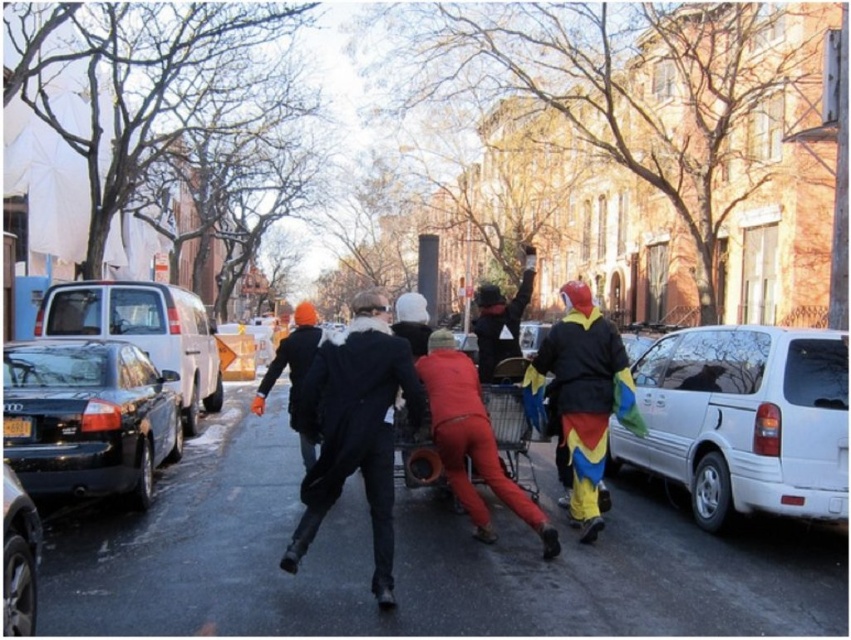
You are a delivery person trying to park your truck in the space between the white matte van at right and the black wool coat at center. Can your truck fit there?

The white matte van at right is smaller than the black wool coat at center, so the space between them may not be large enough for your truck. Check the dimensions carefully before attempting to park.

You are a delivery person trying to deliver a package to the address located near the multicolored fabric pants at right and the metallic silver shopping cart at center. Based on the scene, which object is closer to the delivery location?

The multicolored fabric pants at right is much taller than the metallic silver shopping cart at center, so the delivery location is closer to the multicolored fabric pants at right since it is taller.

You are a pedestrian trying to cross the street safely. You see the white matte van at right and the black wool coat at center. Which object is closer to you as you stand on the sidewalk?

The black wool coat at center is closer to you because it is behind the white matte van at right, meaning the van is between you and the coat.